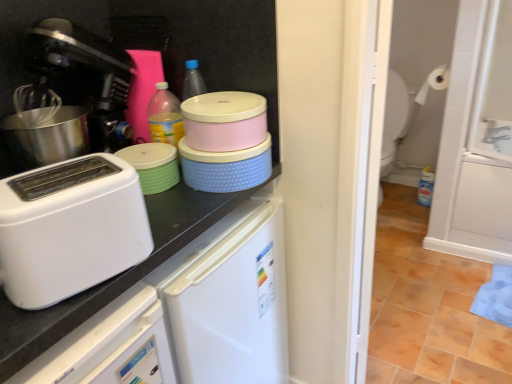
What are the coordinates of `free space to the left of blue glossy bottle at lower right` in the screenshot? It's located at (401, 204).